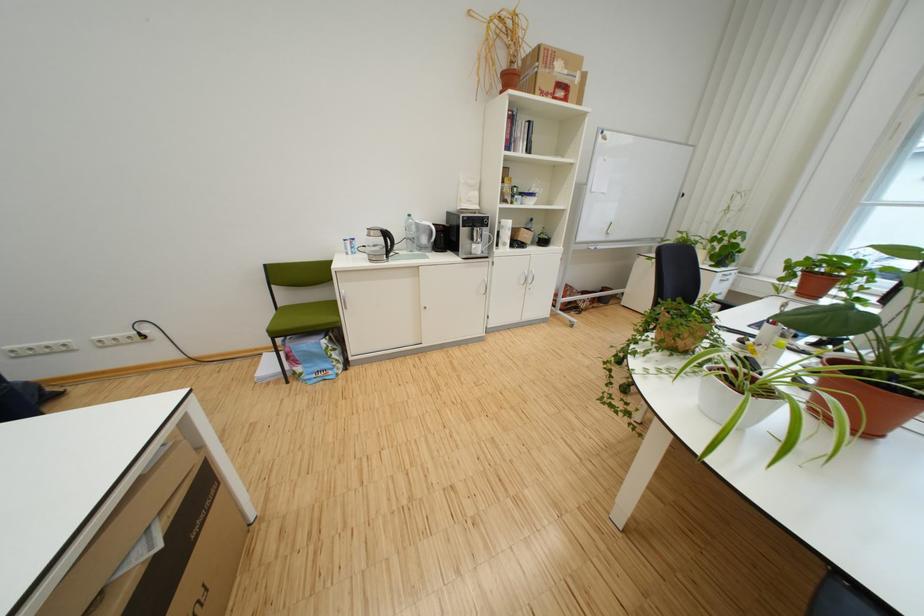
Find where to sit the chair sitting surface. Please return your answer as a coordinate pair (x, y).

(304, 318)